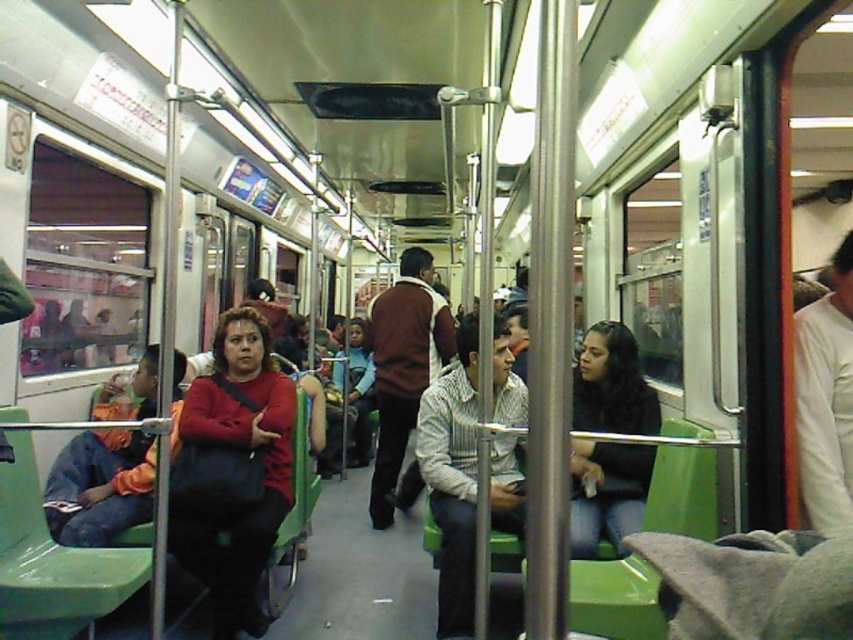
You are a passenger on a crowded subway train and notice two people wearing a striped cotton shirt at center and a brown sweater at center. If you want to give them both a message, which one is closer to you?

The striped cotton shirt at center is 4.03 feet away from the brown sweater at center, so whichever one is closer depends on your position. However, since both are at the center, they are equidistant from you if you are also at the center. If you are positioned differently, the distance would vary.

You are a passenger on the subway and want to sit down. There is a seat available next to the matte red sweater at center and another seat available next to the striped cotton shirt at center. Which seat would give you more personal space?

The seat next to the striped cotton shirt at center would provide more personal space because the matte red sweater at center is narrower than the striped clothing item, indicating the person wearing the striped cotton shirt at center takes up more space.